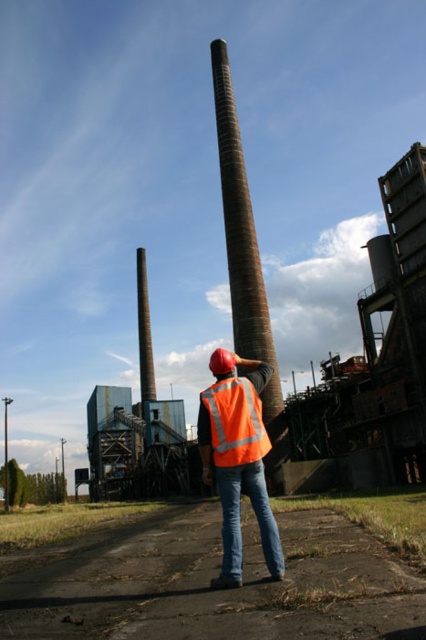
Question: Which object appears closest to the camera in this image?

Choices:
 (A) jeans at center
 (B) brown dirt road at lower center
 (C) orange reflective safety vest at center

Answer: (A)

Question: Is jeans at center bigger than rusty metal chimney at center?

Choices:
 (A) no
 (B) yes

Answer: (A)

Question: Is jeans at center to the left of brown dirt road at lower center from the viewer's perspective?

Choices:
 (A) no
 (B) yes

Answer: (A)

Question: From the image, what is the correct spatial relationship of jeans at center in relation to orange reflective safety vest at center?

Choices:
 (A) above
 (B) below

Answer: (B)

Question: Which point appears closest to the camera in this image?

Choices:
 (A) (25, 518)
 (B) (230, 266)
 (C) (394, 577)
 (D) (241, 556)

Answer: (C)

Question: Among these points, which one is nearest to the camera?

Choices:
 (A) (259, 440)
 (B) (23, 532)
 (C) (336, 556)
 (D) (235, 458)

Answer: (D)